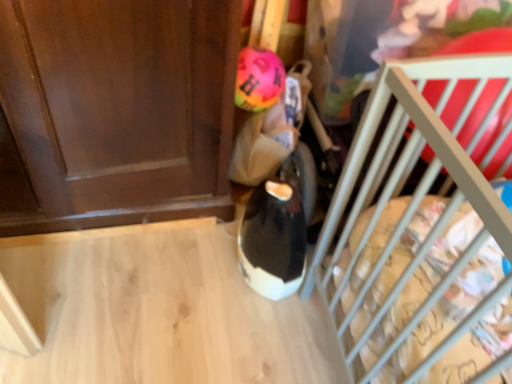
Where is `white plastic crib at right`? This screenshot has width=512, height=384. white plastic crib at right is located at coordinates (404, 207).

The image size is (512, 384). What do you see at coordinates (404, 207) in the screenshot? I see `white plastic crib at right` at bounding box center [404, 207].

Find the location of `white plastic crib at right`. white plastic crib at right is located at coordinates (404, 207).